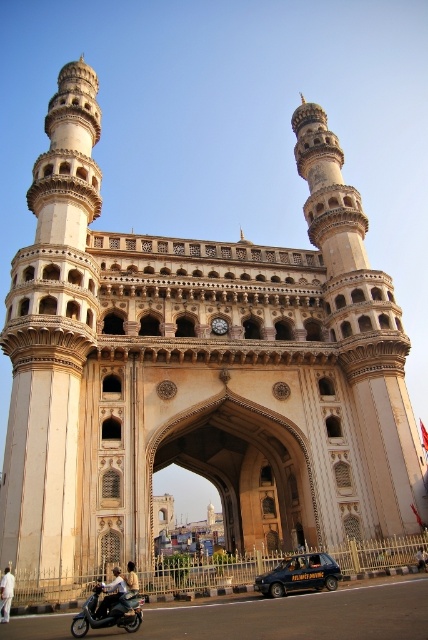
You are a photographer standing in front of the Charminar monument. You notice a person wearing a light blue fabric shirt at center and a light brown leather jacket at center. Which clothing item is positioned higher on the person?

The light blue fabric shirt at center is much taller as the light brown leather jacket at center, so the light blue fabric shirt at center is positioned higher on the person.

You are a tourist visiting Charminar and want to take a photo of the monument. You notice a metallic silver scooter at lower left and a white cotton shirt at center in your frame. Which object should you move to ensure the other is fully visible?

The metallic silver scooter at lower left is larger in size than the white cotton shirt at center. To ensure the white cotton shirt at center is fully visible, you should move the metallic silver scooter at lower left out of the frame.